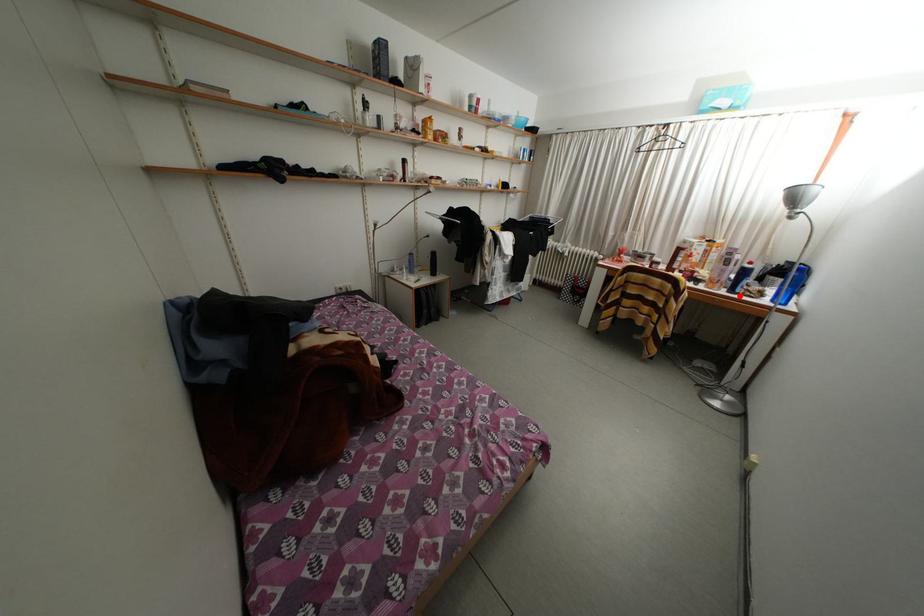
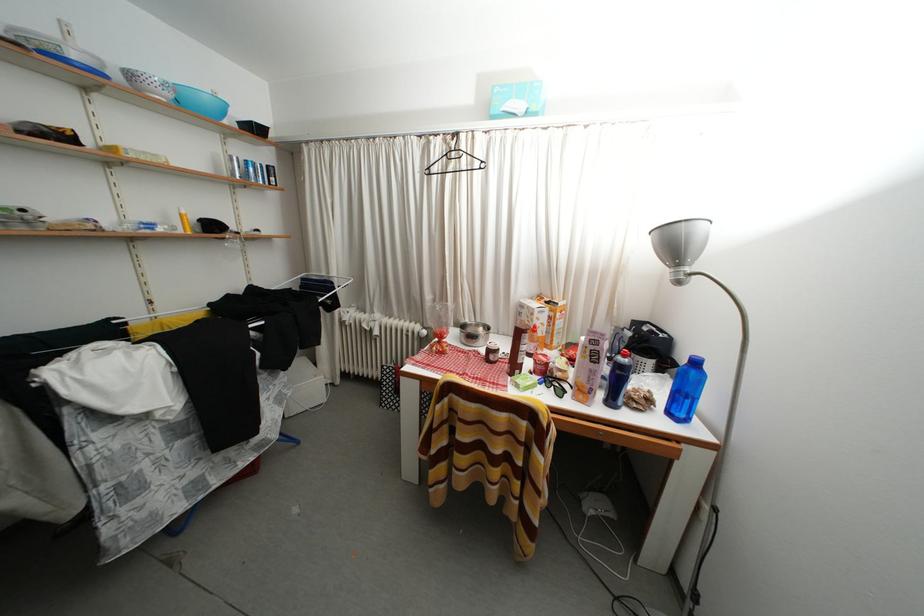
Find the pixel in the second image that matches the highlighted location in the first image.

(618, 408)